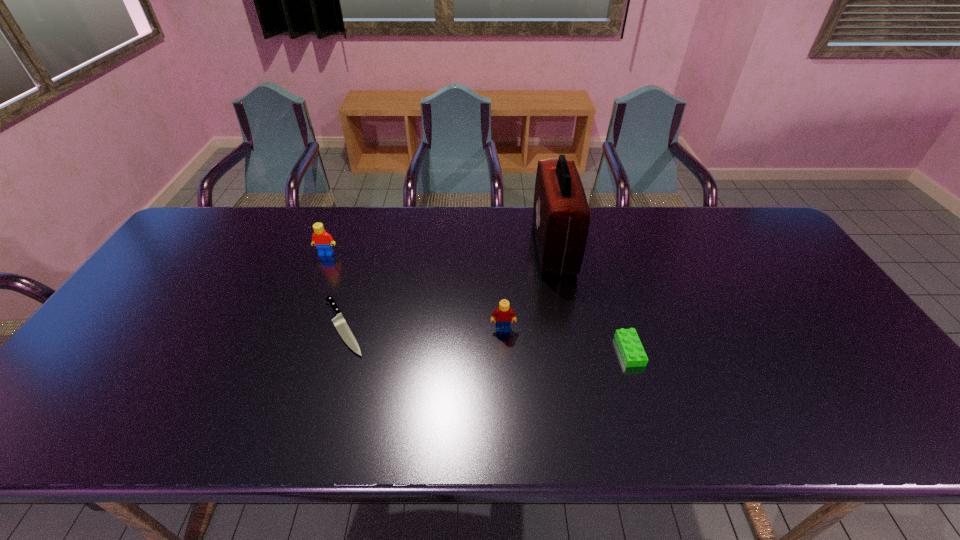
What are the coordinates of `unoccupied position between the farthest Lego and the second nearest Lego` in the screenshot? It's located at (415, 292).

Where is `free space between the second Lego from left to right and the second object from left to right`? Image resolution: width=960 pixels, height=540 pixels. free space between the second Lego from left to right and the second object from left to right is located at coordinates (423, 328).

At what (x,y) coordinates should I click in order to perform the action: click on free space between the tallest object and the shortest Lego. Please return your answer as a coordinate pair (x, y). This screenshot has width=960, height=540. Looking at the image, I should click on (591, 299).

Choose which object is the nearest neighbor to the third object from right to left. Please provide its 2D coordinates. Your answer should be formatted as a tuple, i.e. [(x, y)], where the tuple contains the x and y coordinates of a point satisfying the conditions above.

[(561, 215)]

Select which object is the fourth closest to the tallest object. Please provide its 2D coordinates. Your answer should be formatted as a tuple, i.e. [(x, y)], where the tuple contains the x and y coordinates of a point satisfying the conditions above.

[(323, 241)]

Where is `Lego that is the closest to the steak knife`? Lego that is the closest to the steak knife is located at coordinates (323, 241).

In order to click on the second closest Lego to the fourth tallest object in this screenshot , I will do coord(323,241).

Locate an element on the screen. free space that satisfies the following two spatial constraints: 1. on the front-facing side of the third object from right to left; 2. on the left side of the second shortest object is located at coordinates (504, 350).

In order to click on free point that satisfies the following two spatial constraints: 1. on the side of the tallest object with the cross symbol; 2. on the front-facing side of the second Lego from right to left in this screenshot , I will do `click(569, 329)`.

I want to click on vacant area in the image that satisfies the following two spatial constraints: 1. on the side of the tallest object with the cross symbol; 2. on the left side of the shortest Lego, so click(x=574, y=350).